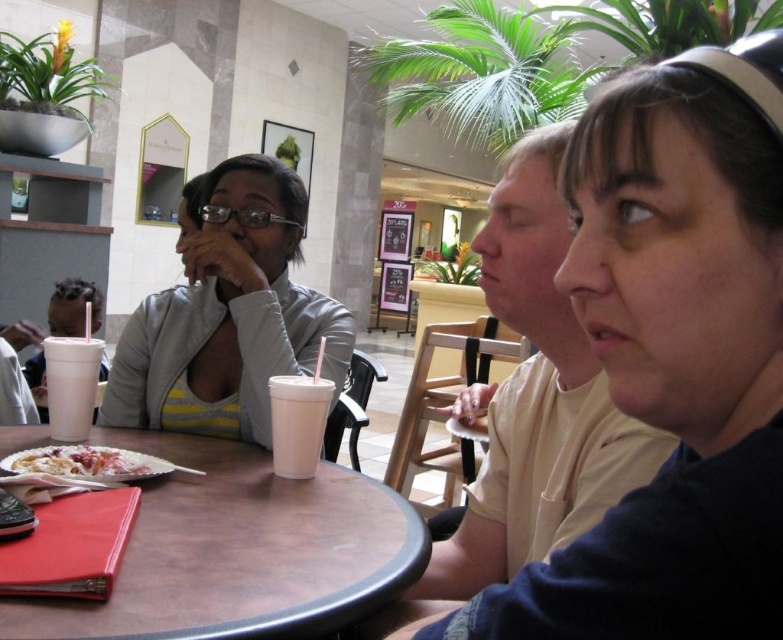
In the scene shown: Who is lower down, light gray jacket at upper left or white matte cup at table left?

white matte cup at table left is lower down.

Which of these two, light gray jacket at upper left or white matte cup at table left, stands taller?

light gray jacket at upper left

Where is `light gray jacket at upper left`? The width and height of the screenshot is (783, 640). light gray jacket at upper left is located at coordinates (228, 316).

Find the location of a particular element. This screenshot has width=783, height=640. light gray jacket at upper left is located at coordinates (228, 316).

Between white matte cup at table center and white matte cup at table left, which one is positioned lower?

Positioned lower is white matte cup at table center.

Between white matte cup at table center and white matte cup at table left, which one appears on the left side from the viewer's perspective?

white matte cup at table left is more to the left.

At what (x,y) coordinates should I click in order to perform the action: click on white matte cup at table center. Please return your answer as a coordinate pair (x, y). The width and height of the screenshot is (783, 640). Looking at the image, I should click on (298, 422).

Is the position of white matte cup at table center more distant than that of white creamy dessert at table center?

Yes, it is.

Can you confirm if white matte cup at table center is taller than white creamy dessert at table center?

Yes.

The height and width of the screenshot is (640, 783). What do you see at coordinates (298, 422) in the screenshot? I see `white matte cup at table center` at bounding box center [298, 422].

At what (x,y) coordinates should I click in order to perform the action: click on white matte cup at table center. Please return your answer as a coordinate pair (x, y). This screenshot has height=640, width=783. Looking at the image, I should click on (298, 422).